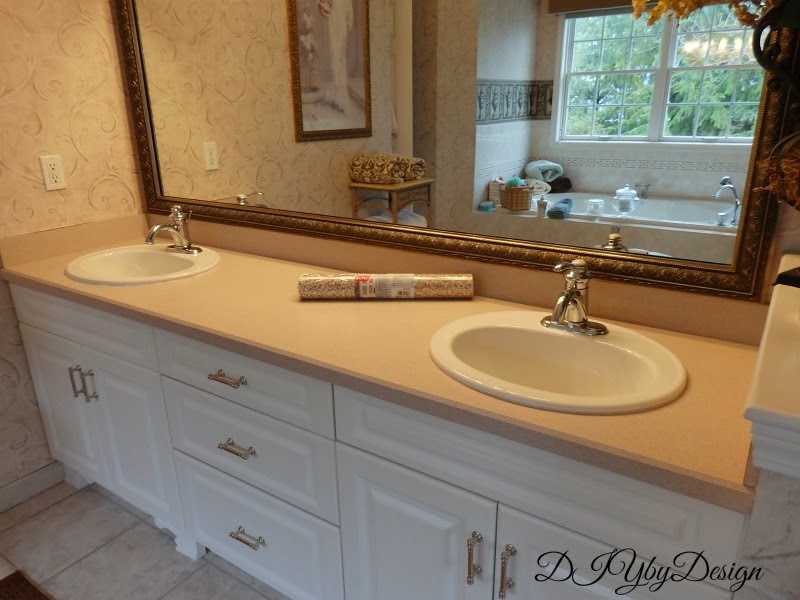
You are a GUI agent. You are given a task and a screenshot of the screen. Output one action in this format:
    pyautogui.click(x=<x>, y=<y>)
    Task: Click on the drawers
    This screenshot has height=600, width=800.
    Given the screenshot: What is the action you would take?
    pyautogui.click(x=274, y=398), pyautogui.click(x=253, y=456), pyautogui.click(x=248, y=533)